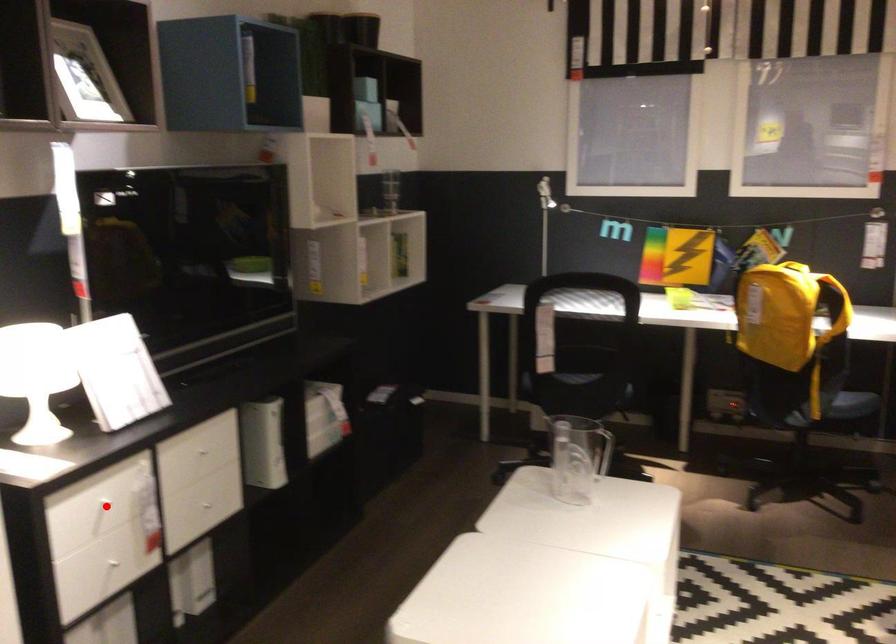
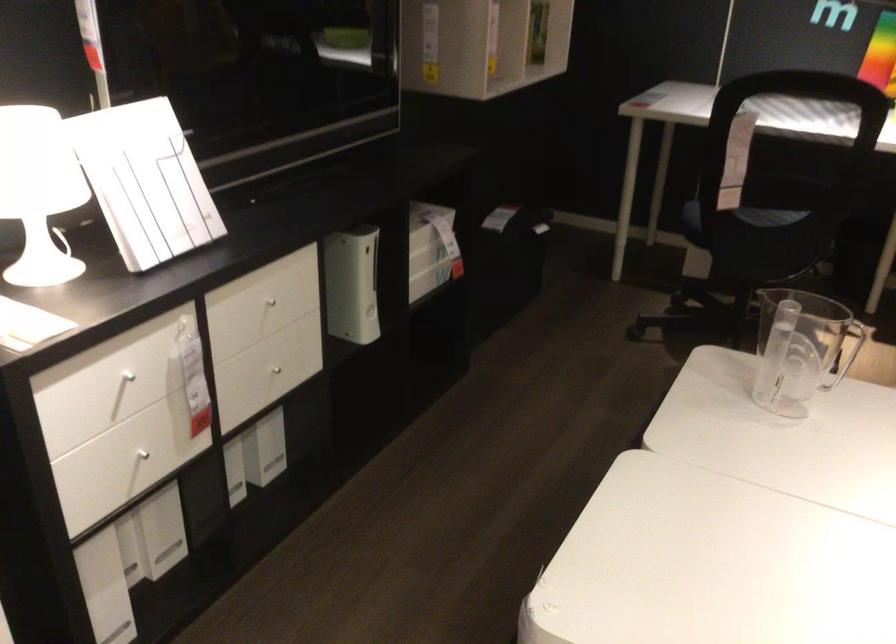
Question: A red point is marked in image1. In image2, is the corresponding 3D point closer to the camera or farther? Reply with the corresponding letter.

Choices:
 (A) The corresponding 3D point is closer.
 (B) The corresponding 3D point is farther.

Answer: (A)